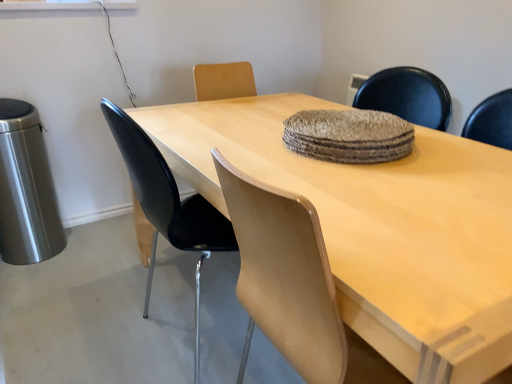
You are a GUI agent. You are given a task and a screenshot of the screen. Output one action in this format:
    pyautogui.click(x=<x>, y=<y>)
    Task: Click on the vacant space behind black plastic chair at left
    Image resolution: width=512 pixels, height=384 pixels.
    Given the screenshot: What is the action you would take?
    pyautogui.click(x=170, y=276)